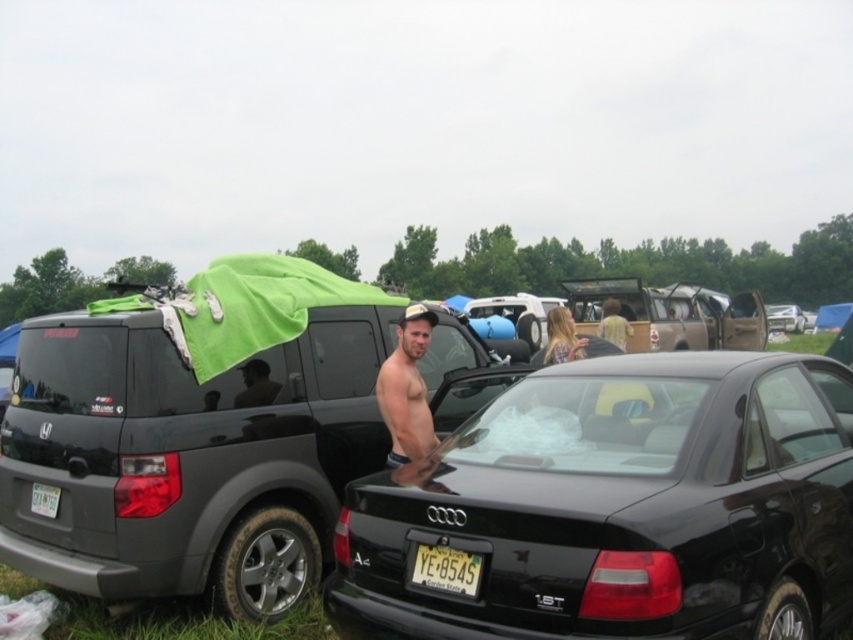
You are a photographer at the car meet and want to capture both the black glossy sedan at center and the yellow matte license plate at center in a single frame. Which object should you focus on first to ensure both are in the shot?

The black glossy sedan at center is positioned on the right side of yellow matte license plate at center. To capture both in a single frame, focus on the yellow matte license plate at center first since it is on the left, allowing the sedan to naturally fall into the right side of the frame.

You are a photographer trying to capture the black glossy sedan at center and the yellow matte license plate at center in a single frame. Since the sedan is taller than the license plate, which object should you focus on first to ensure both are in the frame?

The black glossy sedan at center is taller than the yellow matte license plate at center, so you should focus on the sedan first to ensure its full height is captured before adjusting the frame to include the license plate.